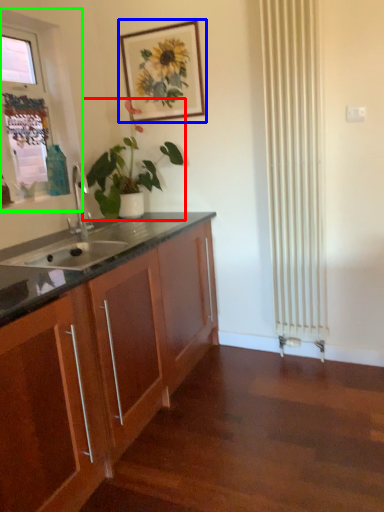
Question: Which object is positioned farthest from houseplant (highlighted by a red box)? Select from picture frame (highlighted by a blue box) and window frame (highlighted by a green box).

Choices:
 (A) picture frame
 (B) window frame

Answer: (B)